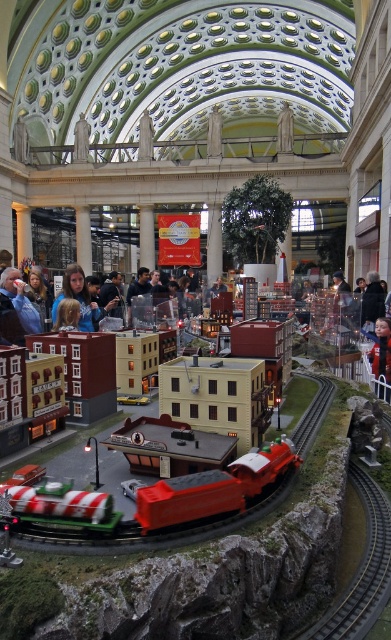
Question: Is metallic silver train track at lower right to the left of blonde hair at center from the viewer's perspective?

Choices:
 (A) no
 (B) yes

Answer: (A)

Question: Which object is the farthest from the shiny red train at center?

Choices:
 (A) blonde hair at center
 (B) blue denim jacket at left

Answer: (A)

Question: Is metallic silver train track at lower right bigger than blue denim jacket at left?

Choices:
 (A) no
 (B) yes

Answer: (A)

Question: Observing the image, what is the correct spatial positioning of shiny red train at center in reference to metallic silver train track at lower right?

Choices:
 (A) right
 (B) left

Answer: (B)

Question: Which object appears closest to the camera in this image?

Choices:
 (A) blue denim jacket at left
 (B) metallic silver train track at lower right

Answer: (B)

Question: Which point is farther from the camera taking this photo?

Choices:
 (A) (5, 280)
 (B) (64, 294)

Answer: (B)